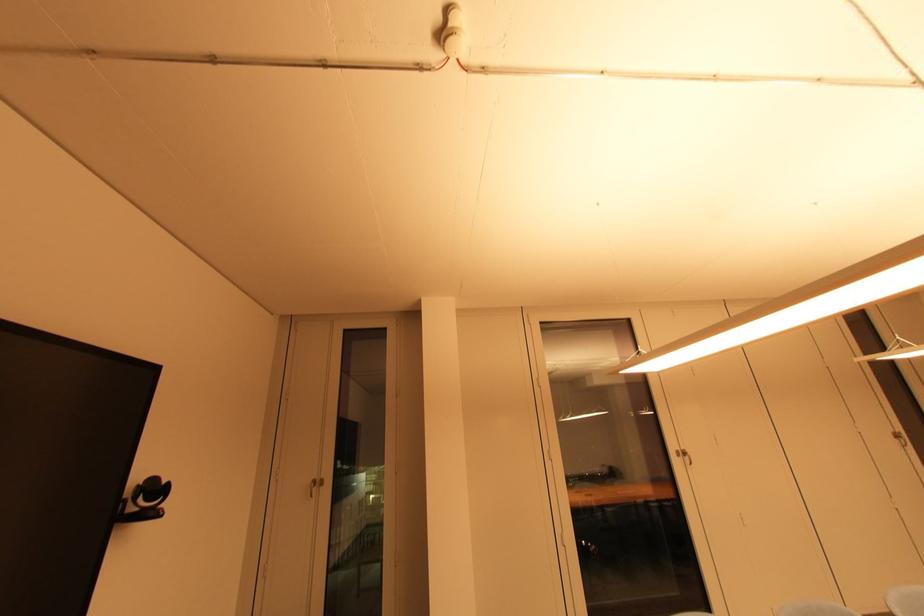
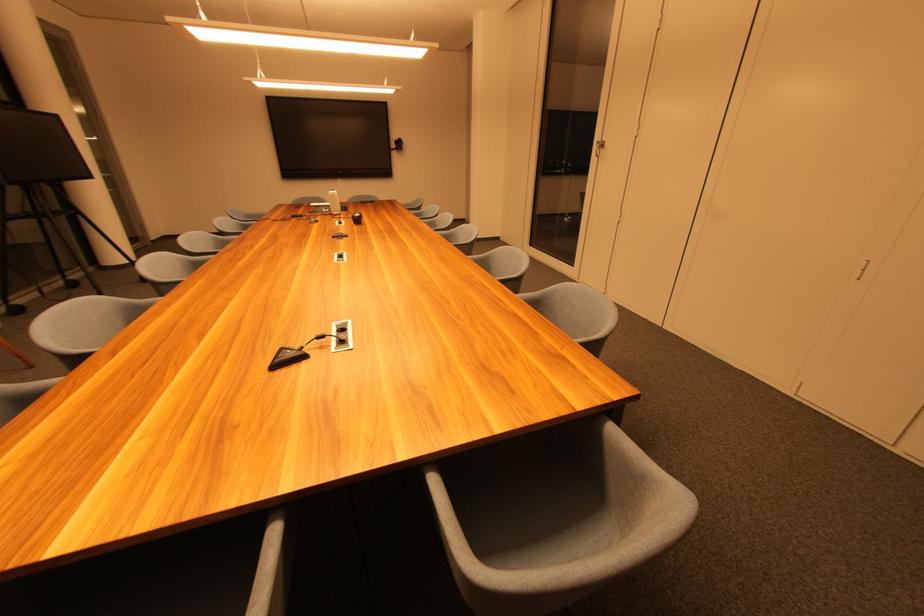
The point at [677,448] is marked in the first image. Where is the corresponding point in the second image?

(602, 140)